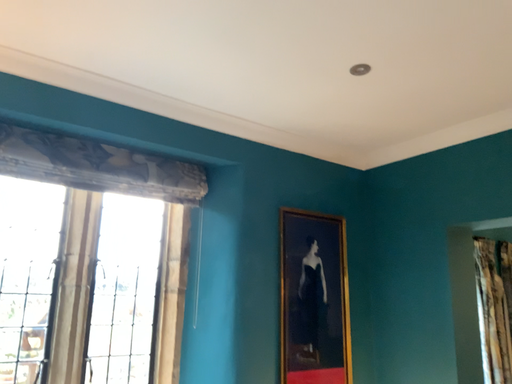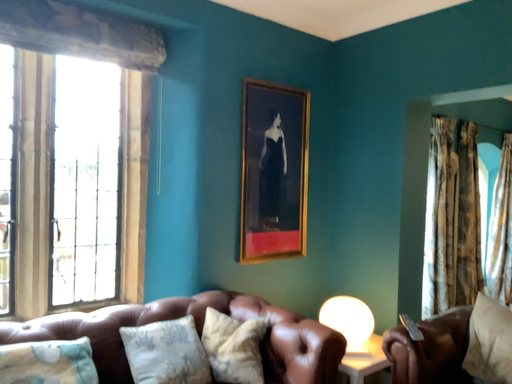
Question: Which way did the camera rotate in the video?

Choices:
 (A) rotated upward
 (B) rotated downward

Answer: (B)